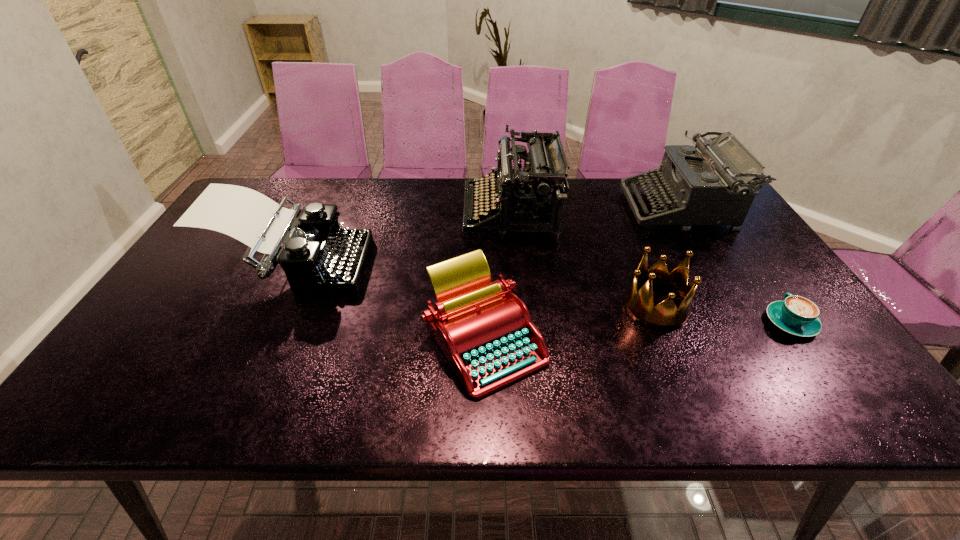
Find the location of a particular element. the rightmost typewriter is located at coordinates (709, 184).

Identify the location of the leftmost object. The height and width of the screenshot is (540, 960). (317, 255).

You are a GUI agent. You are given a task and a screenshot of the screen. Output one action in this format:
    pyautogui.click(x=<x>, y=<y>)
    Task: Click on the crown
    This screenshot has width=960, height=540.
    Given the screenshot: What is the action you would take?
    pyautogui.click(x=639, y=305)

Locate an element on the screen. This screenshot has height=540, width=960. the shortest typewriter is located at coordinates (486, 333).

Identify the location of the shortest object. The width and height of the screenshot is (960, 540). (796, 315).

The width and height of the screenshot is (960, 540). In order to click on vacant region located on the typing side of the rightmost typewriter in this screenshot , I will do `click(560, 208)`.

At what (x,y) coordinates should I click in order to perform the action: click on blank space located on the typing side of the rightmost typewriter. Please return your answer as a coordinate pair (x, y). Looking at the image, I should click on (606, 208).

Find the location of a particular element. The image size is (960, 540). free space located 0.370m on the typing side of the rightmost typewriter is located at coordinates (514, 208).

This screenshot has height=540, width=960. In order to click on blank area located 0.110m on the keys of the leftmost typewriter in this screenshot , I will do `click(406, 266)`.

This screenshot has width=960, height=540. Identify the location of free space located 0.150m on the front of the crown. (687, 384).